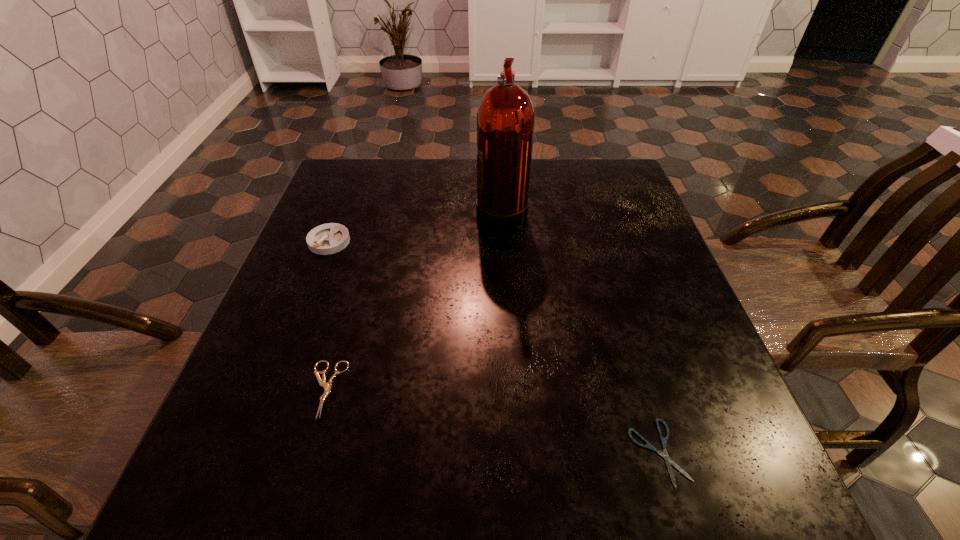
Identify the location of the second object from right to left. The image size is (960, 540). (505, 118).

Where is `the tallest object`? The image size is (960, 540). the tallest object is located at coordinates (505, 118).

This screenshot has height=540, width=960. Find the location of `the leftmost object`. the leftmost object is located at coordinates (329, 238).

Where is `the third shortest object`? This screenshot has width=960, height=540. the third shortest object is located at coordinates tap(329, 238).

Where is `the second shortest object`? the second shortest object is located at coordinates (327, 387).

Locate an element on the screen. the left shears is located at coordinates (327, 387).

Image resolution: width=960 pixels, height=540 pixels. Find the location of `the shortest object`. the shortest object is located at coordinates (663, 440).

Locate an element on the screen. The width and height of the screenshot is (960, 540). the right shears is located at coordinates (663, 440).

The width and height of the screenshot is (960, 540). Find the location of `free space located on the front-facing side of the fire extinguisher`. free space located on the front-facing side of the fire extinguisher is located at coordinates (380, 211).

Image resolution: width=960 pixels, height=540 pixels. I want to click on free space located 0.310m on the front-facing side of the fire extinguisher, so click(357, 211).